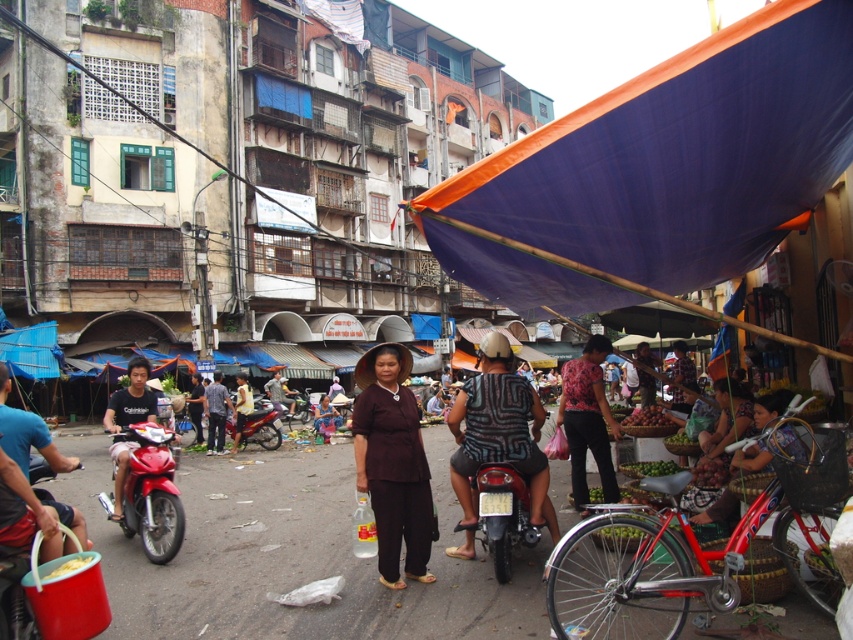
Question: Among these objects, which one is nearest to the camera?

Choices:
 (A) patterned fabric shirt at center
 (B) shiny red motorcycle at center
 (C) shiny black motorcycle at center
 (D) brown matte dress at center

Answer: (C)

Question: Can you confirm if patterned fabric shirt at center is smaller than shiny black motorcycle at center?

Choices:
 (A) no
 (B) yes

Answer: (A)

Question: Can you confirm if brown matte dress at center is bigger than patterned fabric shirt at center?

Choices:
 (A) no
 (B) yes

Answer: (A)

Question: Which of the following is the closest to the observer?

Choices:
 (A) (404, 490)
 (B) (265, 444)
 (C) (498, 472)
 (D) (131, 490)

Answer: (C)

Question: Can you confirm if shiny black motorcycle at center is smaller than shiny red motorcycle at center?

Choices:
 (A) yes
 (B) no

Answer: (A)

Question: Which of the following is the closest to the observer?

Choices:
 (A) brown matte dress at center
 (B) shiny black motorcycle at center
 (C) shiny red motorcycle at center-left
 (D) shiny red motorcycle at center

Answer: (B)